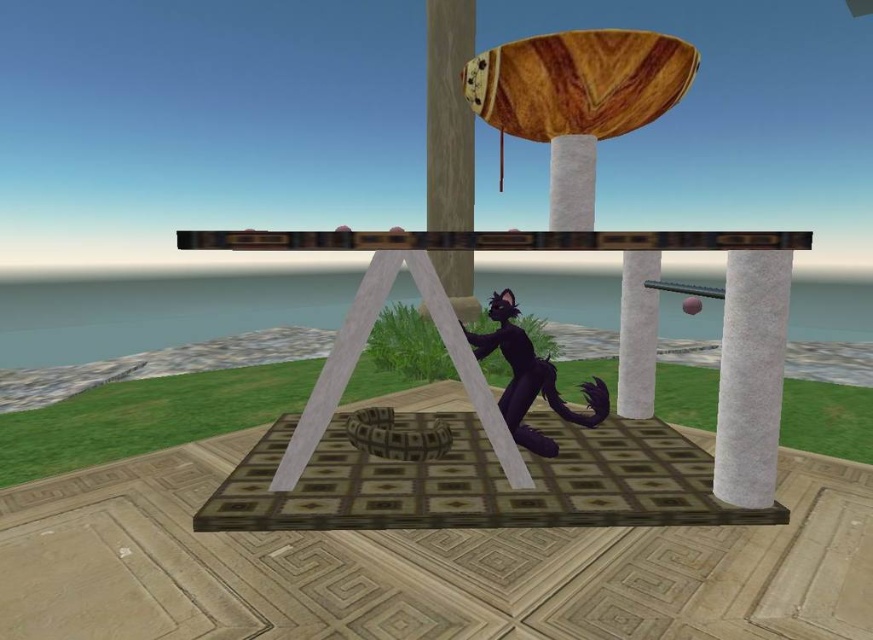
You are an architect designing a new garden and want to place a small statue between the white felt pillar at right and the wooden pole at center. Which object should the statue be closer to if you want it to appear balanced in the scene?

The statue should be closer to the wooden pole at center because the white felt pillar at right is bigger, so placing the statue closer to the smaller wooden pole at center will create balance by counteracting the visual weight of the larger pillar.

You are a character in a game who needs to decide whether to place a small decorative item on the shiny black cat at center or the wooden pole at center. Based on their sizes, which object can accommodate the item more comfortably?

The shiny black cat at center is larger in size than the wooden pole at center, so placing the small decorative item on the shiny black cat at center would be more comfortable and stable.